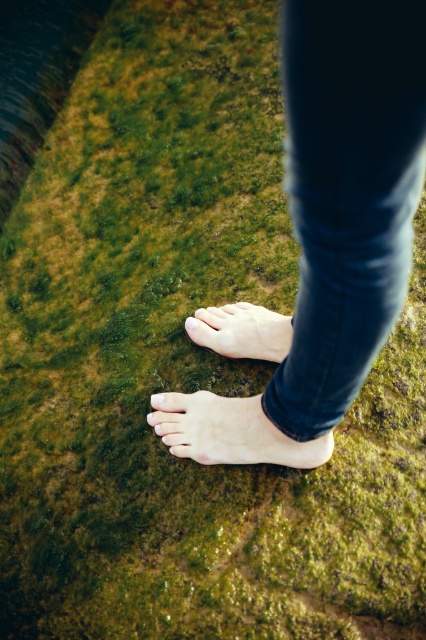
You are a photographer trying to capture the texture of the moss between the dark blue denim jeans at center and the pale skin toe at center. Which object is closer to the camera, allowing you to focus on its texture more clearly?

The dark blue denim jeans at center is closer to the camera than the pale skin toe at center, so its texture can be focused on more clearly.

You are a photographer taking a close up shot of someone standing on mossy ground. You notice the dark blue denim jeans at center and the pale skin toe at center. Which object is closer to the camera?

The dark blue denim jeans at center is closer to the camera than the pale skin toe at center because it is in front of it.